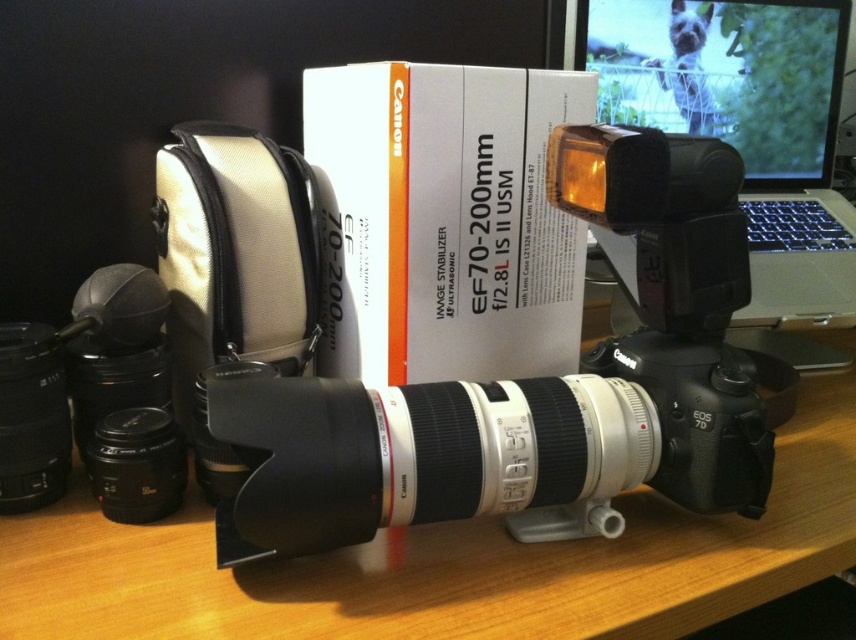
Question: Which point is farther to the camera?

Choices:
 (A) (263, 486)
 (B) (807, 72)
 (C) (337, 326)
 (D) (62, 564)

Answer: (B)

Question: Which point is farther to the camera?

Choices:
 (A) (681, 579)
 (B) (696, 509)
 (C) (658, 90)

Answer: (C)

Question: In this image, where is black plastic camera at center located relative to wooden table at center?

Choices:
 (A) below
 (B) above

Answer: (B)

Question: Among these points, which one is nearest to the camera?

Choices:
 (A) (227, 372)
 (B) (345, 598)
 (C) (370, 160)

Answer: (B)

Question: Can you confirm if white cardboard box at center is thinner than silver metallic laptop at upper right?

Choices:
 (A) no
 (B) yes

Answer: (B)

Question: In this image, where is black plastic camera at center located relative to wooden table at center?

Choices:
 (A) left
 (B) right

Answer: (A)